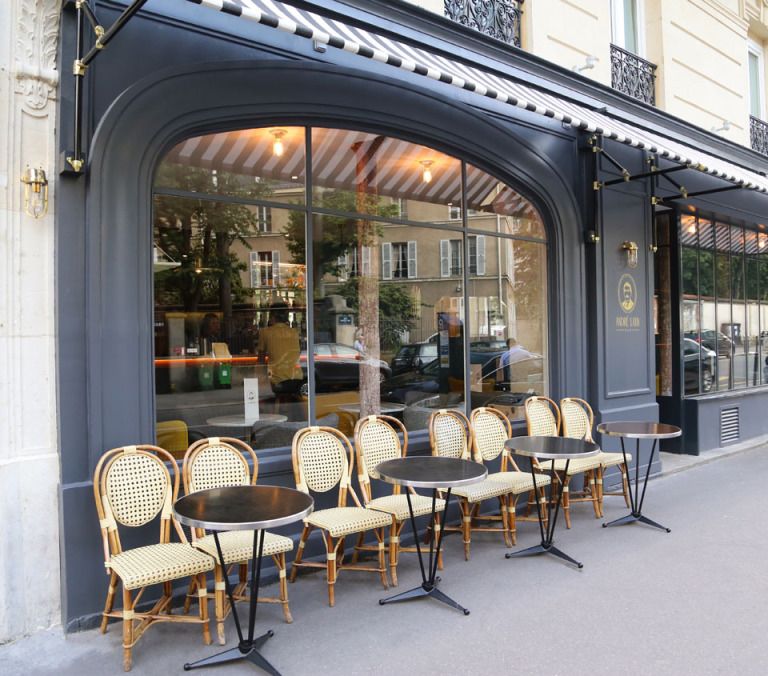
Where is `backs of chairs`? Image resolution: width=768 pixels, height=676 pixels. backs of chairs is located at coordinates (153, 491), (217, 479), (318, 456), (382, 439), (452, 430), (490, 430), (551, 412), (577, 412).